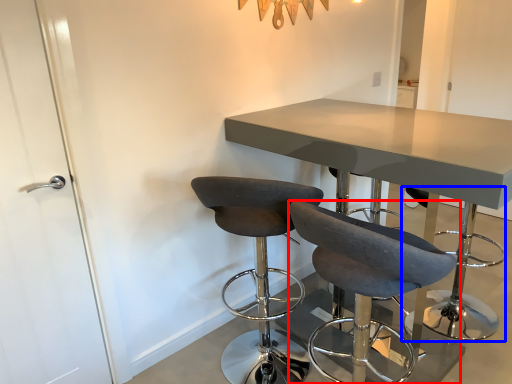
Question: Which of the following is the farthest to the observer, chair (highlighted by a red box) or bar stool (highlighted by a blue box)?

Choices:
 (A) chair
 (B) bar stool

Answer: (B)